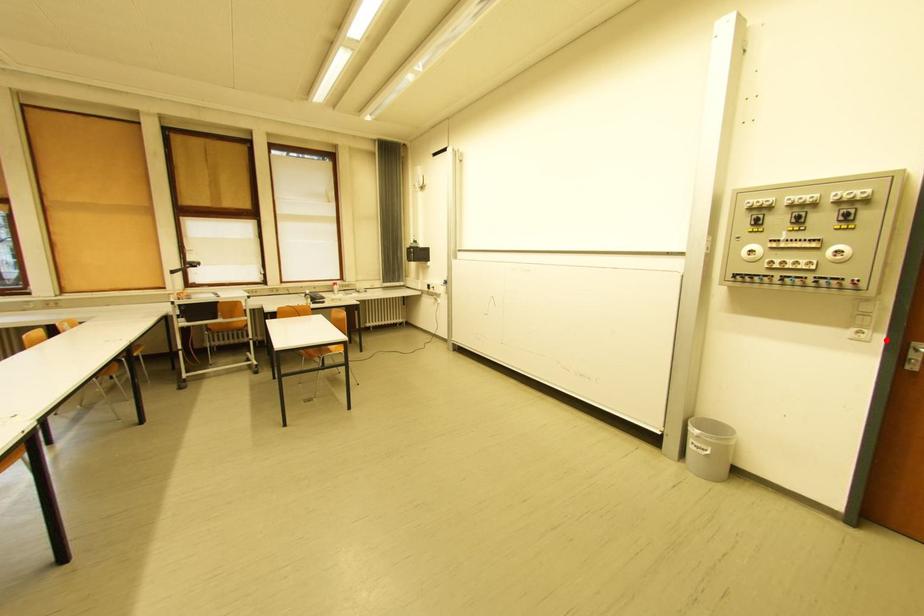
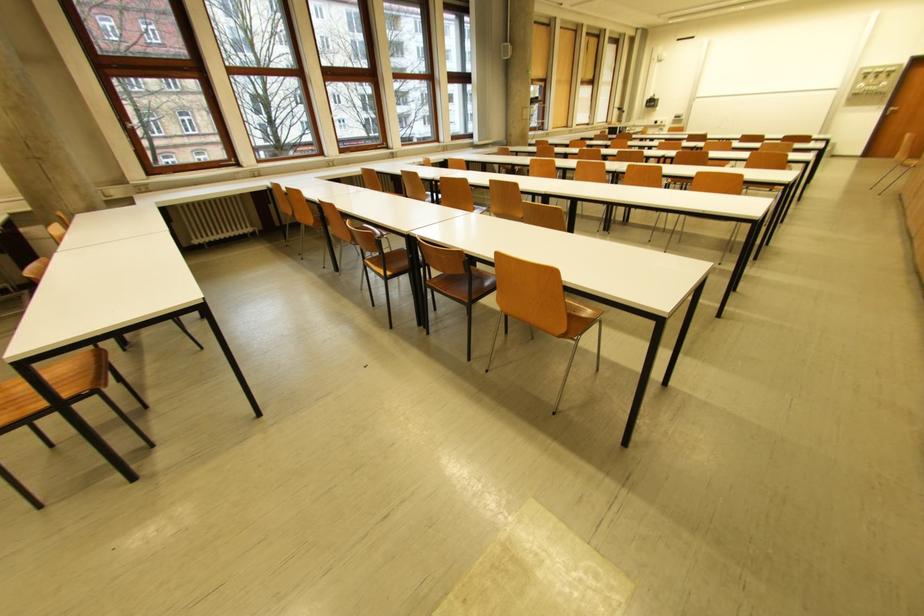
Question: I am providing you with two images of the same scene from different viewpoints. Image1 has a red point marked. In image2, the corresponding 3D location appears at what relative position? Reply with the corresponding letter.

Choices:
 (A) Closer
 (B) Farther

Answer: (B)